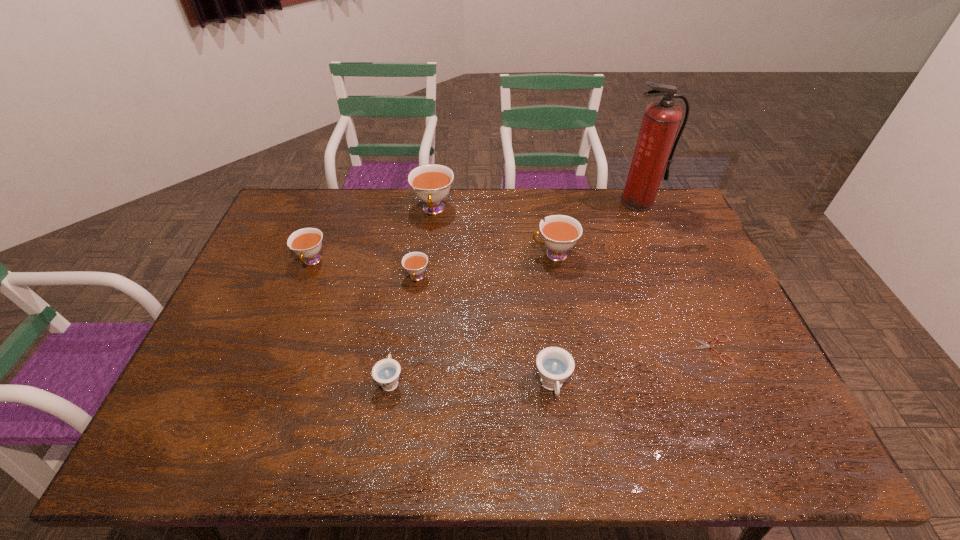
Where is `vacant area that lies between the fire extinguisher and the fifth shortest teacup`? This screenshot has height=540, width=960. vacant area that lies between the fire extinguisher and the fifth shortest teacup is located at coordinates (595, 228).

You are a GUI agent. You are given a task and a screenshot of the screen. Output one action in this format:
    pyautogui.click(x=<x>, y=<y>)
    Task: Click on the vacant space that's between the second tallest teacup and the smaller blue teacup
    This screenshot has height=540, width=960.
    Given the screenshot: What is the action you would take?
    pyautogui.click(x=472, y=318)

Identify the location of free area in between the smallest white teacup and the leftmost white teacup. (365, 269).

The image size is (960, 540). Find the location of `vacant space that's between the rightmost white teacup and the third biggest white teacup`. vacant space that's between the rightmost white teacup and the third biggest white teacup is located at coordinates (433, 258).

I want to click on free space between the tallest object and the tallest teacup, so click(x=536, y=206).

Locate an element on the screen. empty space between the leftmost white teacup and the fifth shortest teacup is located at coordinates (433, 258).

Choose which object is the fourth nearest neighbor to the biggest white teacup. Please provide its 2D coordinates. Your answer should be formatted as a tuple, i.e. [(x, y)], where the tuple contains the x and y coordinates of a point satisfying the conditions above.

[(386, 372)]

Identify which object is the fifth closest to the smallest white teacup. Please provide its 2D coordinates. Your answer should be formatted as a tuple, i.e. [(x, y)], where the tuple contains the x and y coordinates of a point satisfying the conditions above.

[(555, 365)]

Identify the location of teacup that is the closest to the tallest teacup. This screenshot has width=960, height=540. (415, 263).

Choose which teacup is the third nearest neighbor to the red fire extinguisher. Please provide its 2D coordinates. Your answer should be formatted as a tuple, i.e. [(x, y)], where the tuple contains the x and y coordinates of a point satisfying the conditions above.

[(555, 365)]